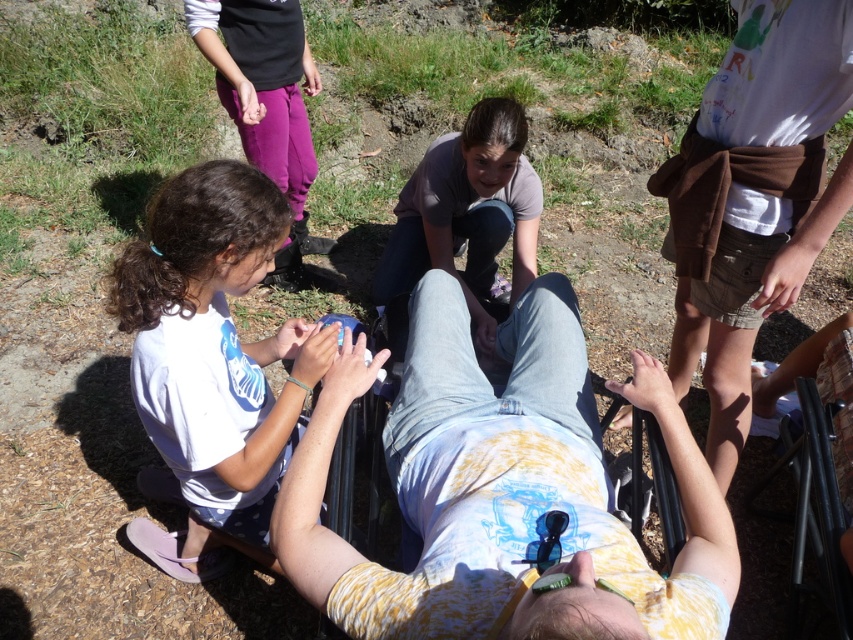
Question: Based on their relative distances, which object is farther from the white matte shirt at center?

Choices:
 (A) denim jeans at center
 (B) matte gray shirt at center

Answer: (B)

Question: Is denim jeans at center below white matte shirt at center?

Choices:
 (A) yes
 (B) no

Answer: (B)

Question: Can you confirm if white matte shirt at center is positioned below matte gray shirt at center?

Choices:
 (A) no
 (B) yes

Answer: (B)

Question: Which object is closer to the camera taking this photo?

Choices:
 (A) white matte shirt at center
 (B) matte gray shirt at center
 (C) denim jeans at center

Answer: (C)

Question: Can you confirm if denim jeans at center is positioned below matte gray shirt at center?

Choices:
 (A) no
 (B) yes

Answer: (B)

Question: Which of the following is the closest to the observer?

Choices:
 (A) (495, 420)
 (B) (271, 241)
 (C) (471, 147)

Answer: (A)